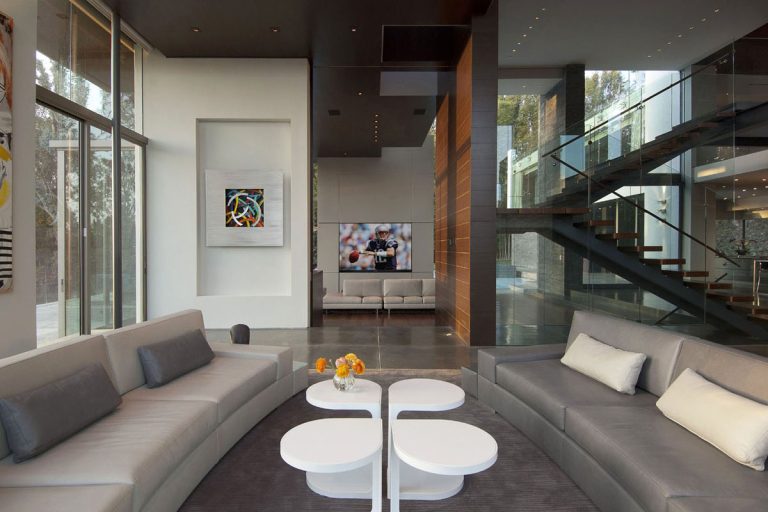
Where is `couch pillow`? This screenshot has height=512, width=768. couch pillow is located at coordinates (174, 362), (50, 411), (603, 353), (710, 412).